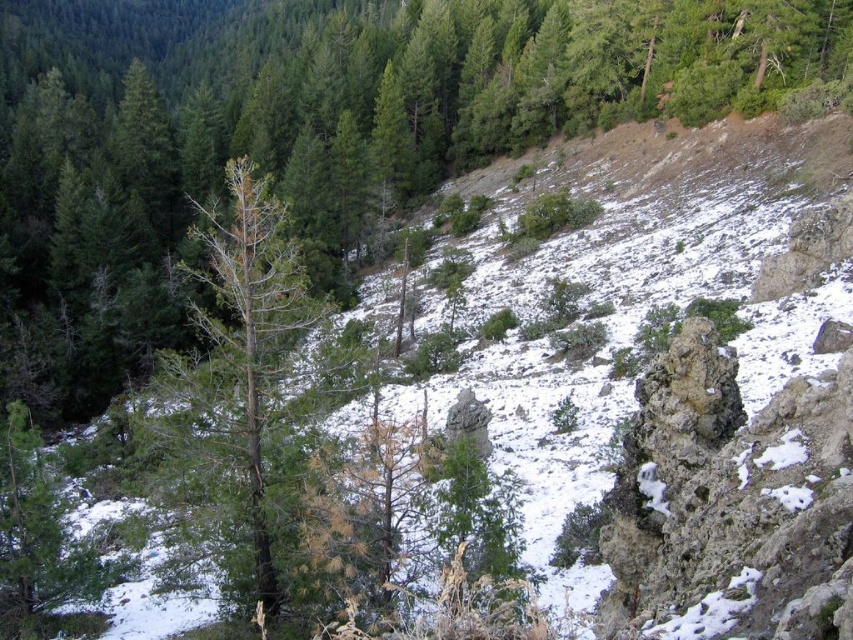
Question: Is green matte tree at center smaller than brown/dried wood tree at left?

Choices:
 (A) yes
 (B) no

Answer: (B)

Question: Among these objects, which one is farthest from the camera?

Choices:
 (A) green matte tree at center
 (B) brown/dried wood tree at left

Answer: (A)

Question: Does green matte tree at center appear on the right side of brown/dried wood tree at left?

Choices:
 (A) yes
 (B) no

Answer: (B)

Question: Can you confirm if green matte tree at center is wider than brown/dried wood tree at left?

Choices:
 (A) no
 (B) yes

Answer: (B)

Question: Among these points, which one is farthest from the camera?

Choices:
 (A) (263, 236)
 (B) (73, 387)

Answer: (B)